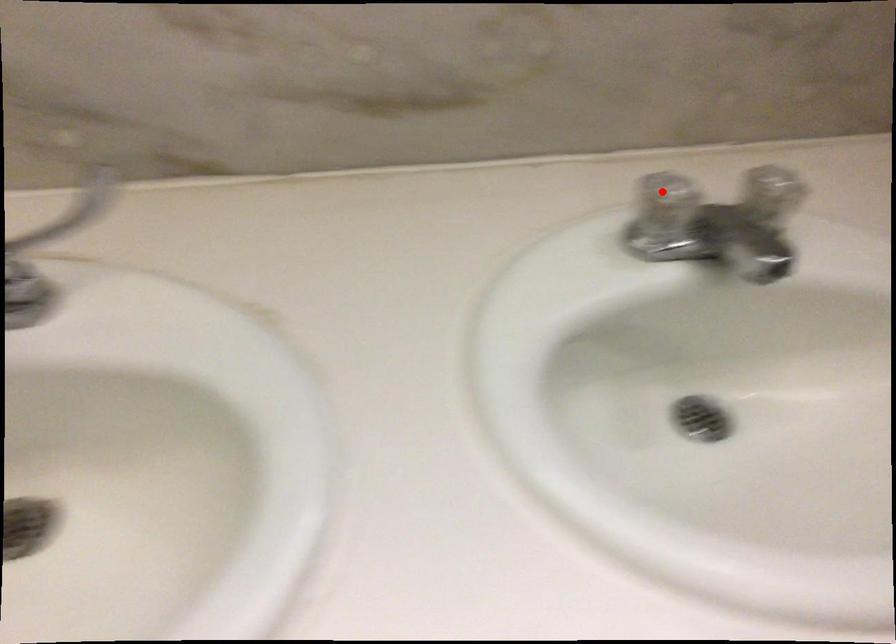
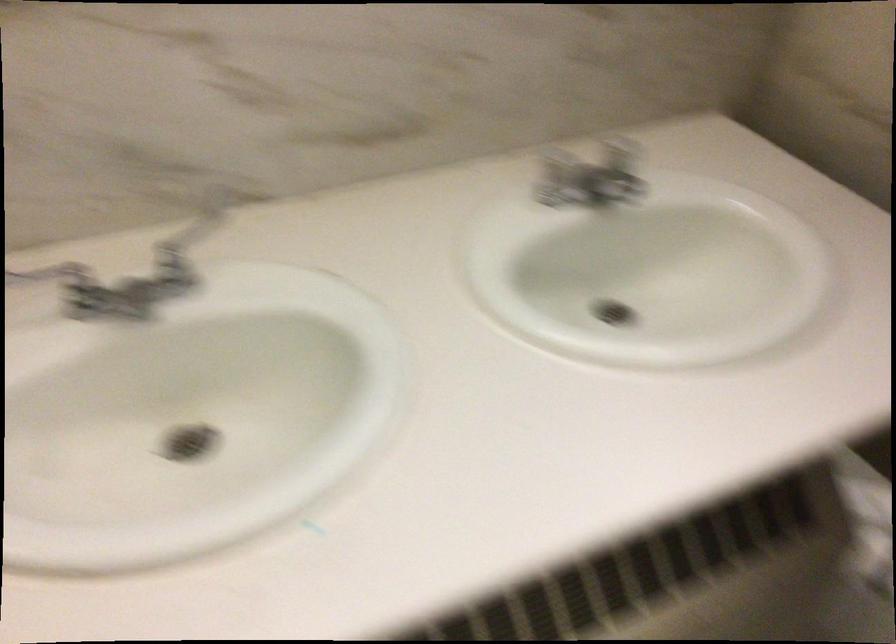
Question: I am providing you with two images of the same scene from different viewpoints. In image1, a red point is highlighted. Considering the same 3D point in image2, which of the following is correct?

Choices:
 (A) It is closer
 (B) It is farther

Answer: (B)